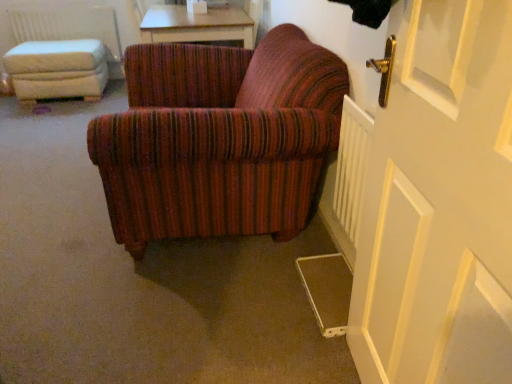
Locate an element on the screen. Image resolution: width=512 pixels, height=384 pixels. light brown wooden table at upper center is located at coordinates (196, 25).

What do you see at coordinates (57, 69) in the screenshot? I see `white fabric ottoman at left` at bounding box center [57, 69].

At what (x,y) coordinates should I click in order to perform the action: click on white wooden door at right. Please return your answer as a coordinate pair (x, y). Looking at the image, I should click on (439, 202).

From a real-world perspective, between white plastic radiator at lower right, marked as the second radiator in a back-to-front arrangement, and light brown wooden table at upper center, who is vertically higher?

light brown wooden table at upper center, from a real-world perspective.

Which object is positioned more to the right, white plastic radiator at lower right, the first radiator when ordered from front to back, or light brown wooden table at upper center?

From the viewer's perspective, white plastic radiator at lower right, the first radiator when ordered from front to back, appears more on the right side.

Can you confirm if white plastic radiator at lower right, which appears as the 1th radiator when ordered from the bottom, is thinner than light brown wooden table at upper center?

Yes.

Is white plastic radiator at lower right, which is the 2th radiator in left-to-right order, inside the boundaries of light brown wooden table at upper center, or outside?

white plastic radiator at lower right, which is the 2th radiator in left-to-right order, is not enclosed by light brown wooden table at upper center.

In the image, is white fabric ottoman at left on the left side or the right side of light brown wooden table at upper center?

In the image, white fabric ottoman at left appears on the left side of light brown wooden table at upper center.

Based on their sizes in the image, would you say white fabric ottoman at left is bigger or smaller than light brown wooden table at upper center?

In the image, white fabric ottoman at left appears to be smaller than light brown wooden table at upper center.

Find the location of a particular element. Image resolution: width=512 pixels, height=384 pixels. table on the right of white fabric ottoman at left is located at coordinates click(196, 25).

Are white fabric ottoman at left and light brown wooden table at upper center making contact?

No, white fabric ottoman at left is not making contact with light brown wooden table at upper center.

Is white fabric ottoman at left aimed at white plastic radiator at lower right, which is the 2th radiator in top-to-bottom order?

No, white fabric ottoman at left is not oriented towards white plastic radiator at lower right, which is the 2th radiator in top-to-bottom order.

Is white fabric ottoman at left to the right of white plastic radiator at lower right, acting as the 1th radiator starting from the right, from the viewer's perspective?

No, white fabric ottoman at left is not to the right of white plastic radiator at lower right, acting as the 1th radiator starting from the right.

Is point (50, 57) closer or farther from the camera than point (349, 178)?

Point (50, 57) is positioned farther from the camera compared to point (349, 178).

At what (x,y) coordinates should I click in order to perform the action: click on radiator located in front of the white fabric ottoman at left. Please return your answer as a coordinate pair (x, y). The height and width of the screenshot is (384, 512). Looking at the image, I should click on (351, 166).

From the image's perspective, is white wooden door at right above or below light brown wooden table at upper center?

From the image's perspective, white wooden door at right appears below light brown wooden table at upper center.

Is white wooden door at right far away from light brown wooden table at upper center?

Absolutely, white wooden door at right is distant from light brown wooden table at upper center.

Considering their positions, is white wooden door at right located in front of or behind light brown wooden table at upper center?

In the image, white wooden door at right appears in front of light brown wooden table at upper center.

Is white wooden door at right facing towards light brown wooden table at upper center?

No, white wooden door at right is not turned towards light brown wooden table at upper center.

Where is `table that is above the white fabric ottoman at left (from the image's perspective)`? table that is above the white fabric ottoman at left (from the image's perspective) is located at coordinates (196, 25).

Is point (228, 13) farther from viewer compared to point (99, 45)?

No.

Does light brown wooden table at upper center have a greater height compared to white fabric ottoman at left?

Incorrect, the height of light brown wooden table at upper center is not larger of that of white fabric ottoman at left.

Considering the positions of objects light brown wooden table at upper center and white fabric ottoman at left in the image provided, who is behind, light brown wooden table at upper center or white fabric ottoman at left?

white fabric ottoman at left is more distant.

Is white wooden door at right in front of or behind white plastic radiator at lower right, which appears as the 1th radiator when ordered from the bottom, in the image?

In the image, white wooden door at right appears in front of white plastic radiator at lower right, which appears as the 1th radiator when ordered from the bottom.

Is point (354, 296) in front of point (352, 192)?

That is True.

From a real-world perspective, who is located higher, white wooden door at right or white plastic radiator at lower right, the first radiator when ordered from front to back?

white wooden door at right, from a real-world perspective.

Considering their positions, is white fabric radiator at upper left, the second radiator from the front, located in front of or behind white wooden door at right?

Clearly, white fabric radiator at upper left, the second radiator from the front, is behind white wooden door at right.

Looking at this image, would you consider white fabric radiator at upper left, the 1th radiator from the back, to be distant from white wooden door at right?

Absolutely, white fabric radiator at upper left, the 1th radiator from the back, is distant from white wooden door at right.

Where is `the 1st radiator directly beneath the light brown wooden table at upper center (from a real-world perspective)`? the 1st radiator directly beneath the light brown wooden table at upper center (from a real-world perspective) is located at coordinates click(351, 166).

You are a GUI agent. You are given a task and a screenshot of the screen. Output one action in this format:
    pyautogui.click(x=<x>, y=<y>)
    Task: Click on the table to the right of white fabric ottoman at left
    This screenshot has width=512, height=384.
    Given the screenshot: What is the action you would take?
    pyautogui.click(x=196, y=25)

Which object lies further to the anchor point white wooden door at right, white fabric radiator at upper left, marked as the second radiator in a bottom-to-top arrangement, or light brown wooden table at upper center?

Based on the image, white fabric radiator at upper left, marked as the second radiator in a bottom-to-top arrangement, appears to be further to white wooden door at right.

Which object lies nearer to the anchor point light brown wooden table at upper center, white plastic radiator at lower right, acting as the 1th radiator starting from the right, or white wooden door at right?

The object closer to light brown wooden table at upper center is white plastic radiator at lower right, acting as the 1th radiator starting from the right.

Looking at the image, which one is located further to white wooden door at right, white plastic radiator at lower right, acting as the 1th radiator starting from the right, or white fabric radiator at upper left, the second radiator from the front?

white fabric radiator at upper left, the second radiator from the front.

Considering their positions, is white fabric radiator at upper left, marked as the second radiator in a bottom-to-top arrangement, positioned further to white fabric ottoman at left than white plastic radiator at lower right, marked as the second radiator in a back-to-front arrangement?

white plastic radiator at lower right, marked as the second radiator in a back-to-front arrangement.

When comparing their distances from white fabric radiator at upper left, marked as the second radiator in a bottom-to-top arrangement, does white fabric ottoman at left or white plastic radiator at lower right, marked as the second radiator in a back-to-front arrangement, seem closer?

white fabric ottoman at left is closer to white fabric radiator at upper left, marked as the second radiator in a bottom-to-top arrangement.

Considering their positions, is light brown wooden table at upper center positioned closer to white fabric ottoman at left than white plastic radiator at lower right, acting as the 1th radiator starting from the right?

light brown wooden table at upper center is positioned closer to the anchor white fabric ottoman at left.

Looking at the image, which one is located further to white plastic radiator at lower right, which is the 2th radiator in top-to-bottom order, light brown wooden table at upper center or white wooden door at right?

Based on the image, light brown wooden table at upper center appears to be further to white plastic radiator at lower right, which is the 2th radiator in top-to-bottom order.

When comparing their distances from white fabric ottoman at left, does white wooden door at right or white fabric radiator at upper left, which is counted as the 1th radiator, starting from the left, seem further?

Among the two, white wooden door at right is located further to white fabric ottoman at left.

Identify the location of table between white plastic radiator at lower right, which appears as the 1th radiator when ordered from the bottom, and white fabric radiator at upper left, which is the 2th radiator from right to left, from front to back. (196, 25).

Identify the location of radiator between white wooden door at right and white fabric ottoman at left in the front-back direction. The width and height of the screenshot is (512, 384). (351, 166).

The width and height of the screenshot is (512, 384). What are the coordinates of `stool located between white wooden door at right and white fabric radiator at upper left, the second radiator from the front, in the depth direction` in the screenshot? It's located at (57, 69).

What are the coordinates of `stool located between white plastic radiator at lower right, which is the 2th radiator in left-to-right order, and white fabric radiator at upper left, marked as the second radiator in a bottom-to-top arrangement, in the depth direction` in the screenshot? It's located at (57, 69).